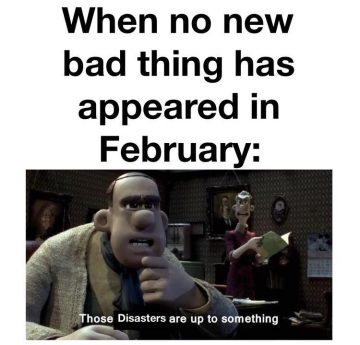
You are a GUI agent. You are given a task and a screenshot of the screen. Output one action in this format:
    pyautogui.click(x=<x>, y=<y>)
    Task: Click on the calender
    The height and width of the screenshot is (345, 360).
    Given the screenshot: What is the action you would take?
    pyautogui.click(x=313, y=266)